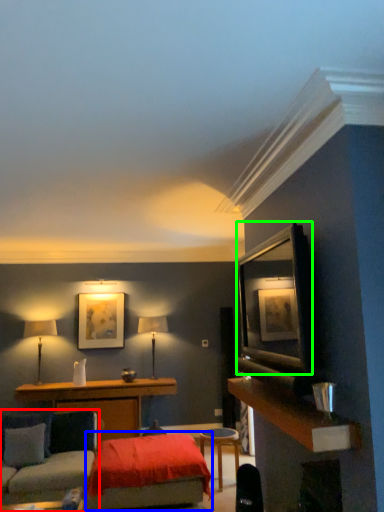
Question: Which object is the farthest from studio couch (highlighted by a red box)? Choose among these: bed (highlighted by a blue box) or shelf (highlighted by a green box).

Choices:
 (A) bed
 (B) shelf

Answer: (B)